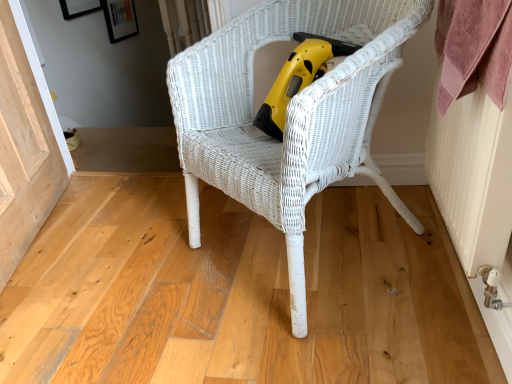
Find the location of a particular element. vacant space underneath white wicker chair at center (from a real-world perspective) is located at coordinates (307, 251).